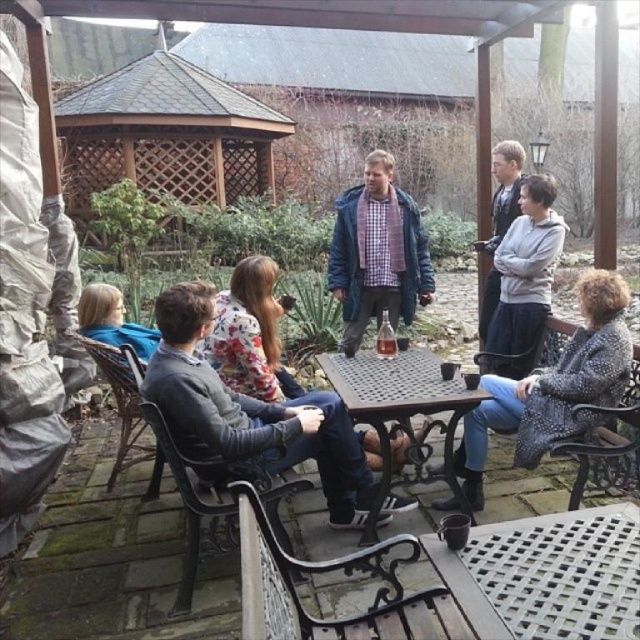
You are standing under the pergola and want to hand a book to the person with the light brown hair at lower left. The book is currently on the patterned fabric coat at lower right. Can you reach the book without moving from your current position?

The patterned fabric coat at lower right is closer to the viewer than the light brown hair at lower left. Since the coat is closer, you can likely reach the book on it without needing to move.

You are a photographer trying to capture a group photo of the people under the pergola. You notice the patterned fabric coat at lower right and the light brown hair at lower left. Which object should you adjust your camera angle to focus on first to ensure both are in frame?

The patterned fabric coat at lower right is much taller than the light brown hair at lower left, so you should focus on the patterned fabric coat at lower right first to ensure both are in frame.